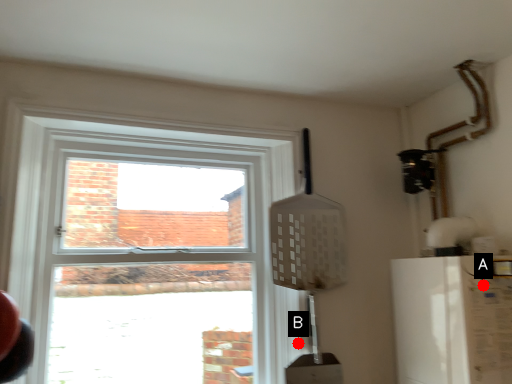
Question: Two points are circled on the image, labeled by A and B beside each circle. Which point is closer to the camera?

Choices:
 (A) A is closer
 (B) B is closer

Answer: (A)